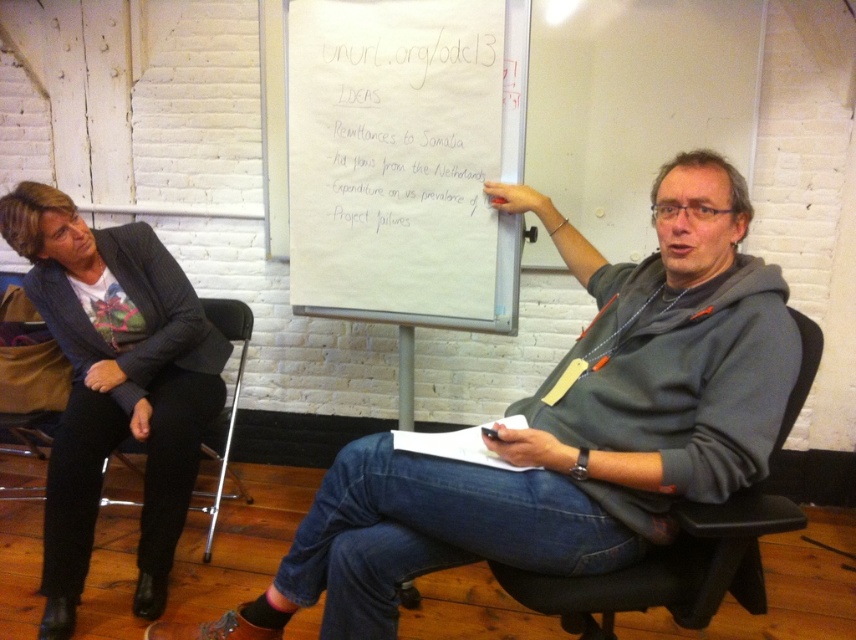
You are a photographer standing at the camera position. You want to take a closeup shot of the black leather chair at center without moving the camera. Is it possible to do so with a standard zoom lens that has a maximum zoom of 200mm?

The black leather chair at center is 4.36 feet away from the camera. With a standard zoom lens up to 200mm, it is possible to capture a closeup of the black leather chair at center without moving the camera, as the distance is within the effective range of the lens.

You are standing at the origin point in the room where the black leather chair at center is located. If you walk straight towards the chair, will you reach it before reaching the flip chart?

The black leather chair at center is located at point (669, 568). Since the flip chart is placed between the two individuals, and the chair is at the center, you would reach the flip chart first before the chair if moving straight from the origin.

You are standing in the room where the two people are discussing. The whiteboard at center is represented by point (403, 160). If you want to write on the whiteboard at center, where should you position yourself relative to the two people?

The whiteboard at center is located at point (403, 160), so you should position yourself in front of the whiteboard at center to write on it.